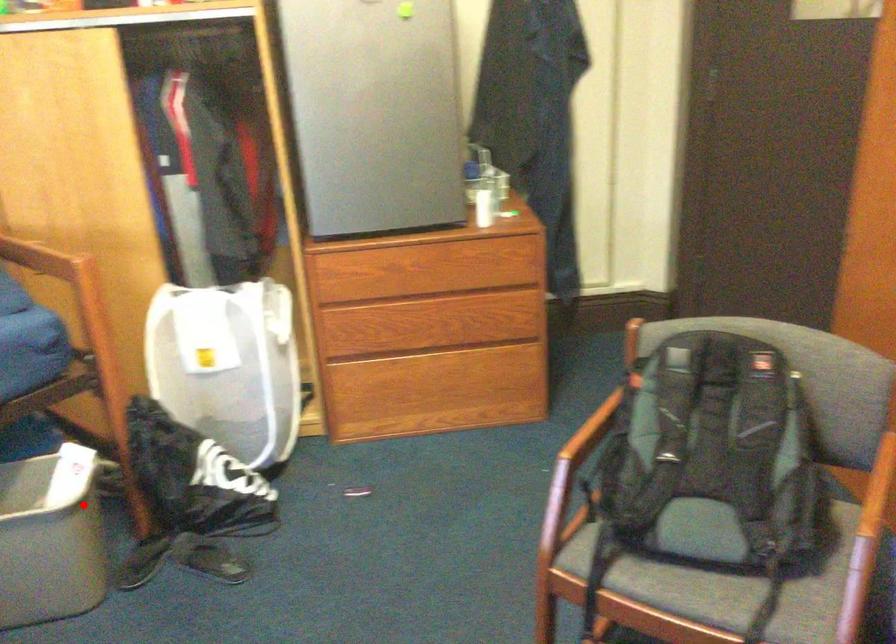
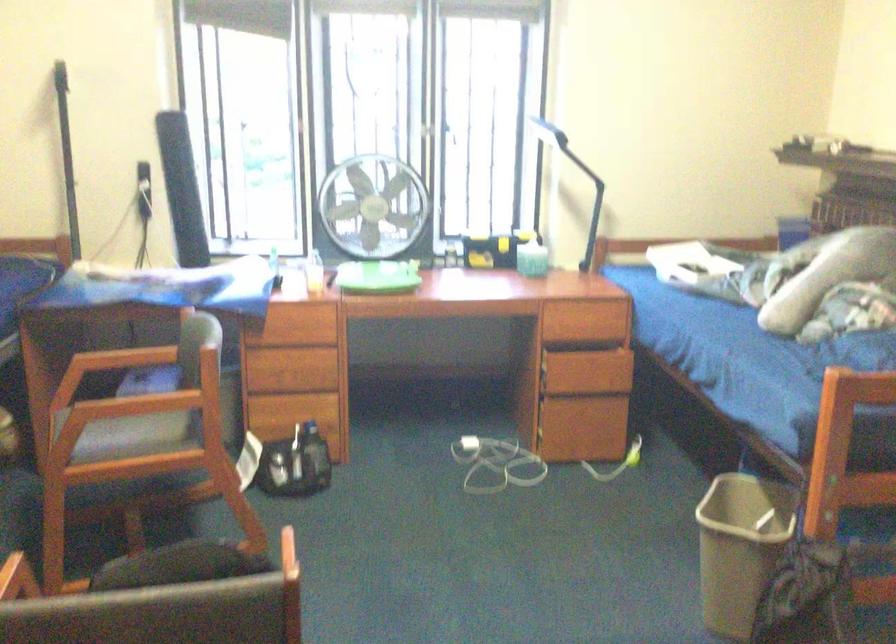
Question: I am providing you with two images of the same scene from different viewpoints. Given a red point in image1, look at the same physical point in image2. Is it:

Choices:
 (A) Closer to the viewpoint
 (B) Farther from the viewpoint

Answer: (B)